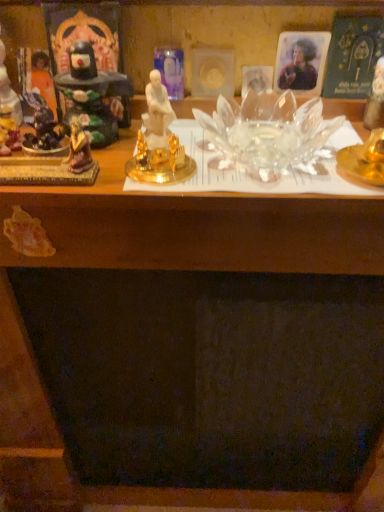
Measure the distance between point (19, 132) and camera.

The depth of point (19, 132) is 56.90 centimeters.

Find the location of a particular element. transparent glass candle at upper right, the fourth toy positioned from the left is located at coordinates (375, 99).

What are the coordinates of `orange fabric statue at left, the 2th person when ordered from right to left` in the screenshot? It's located at (43, 79).

Locate an element on the screen. transparent glass bowl at center is located at coordinates (196, 227).

Locate an element on the screen. This screenshot has width=384, height=512. matte black statue at left, which is the 1th toy in left-to-right order is located at coordinates (8, 91).

Between matte purple figurine at left, arranged as the 3th toy when viewed from the right, and matte plastic photo at upper right, which is the first person from right to left, which one has smaller size?

With smaller size is matte plastic photo at upper right, which is the first person from right to left.

Considering the points (15, 132) and (290, 85), which point is in front, point (15, 132) or point (290, 85)?

The point (15, 132) is in front.

Does matte purple figurine at left, arranged as the 3th toy when viewed from the right, turn towards matte plastic photo at upper right, positioned as the second person in left-to-right order?

No, matte purple figurine at left, arranged as the 3th toy when viewed from the right, is not turned towards matte plastic photo at upper right, positioned as the second person in left-to-right order.

Looking at this image, from the image's perspective, relative to orange fabric statue at left, the 2th person when ordered from right to left, is matte black statue at left, which is counted as the third toy, starting from the left, above or below?

Based on their image positions, matte black statue at left, which is counted as the third toy, starting from the left, is located beneath orange fabric statue at left, the 2th person when ordered from right to left.

Can you tell me how much matte black statue at left, the 2th toy when ordered from right to left, and orange fabric statue at left, the 2th person when ordered from right to left, differ in facing direction?

matte black statue at left, the 2th toy when ordered from right to left, and orange fabric statue at left, the 2th person when ordered from right to left, are facing 4.78 degrees away from each other.

From a real-world perspective, is matte black statue at left, the 2th toy when ordered from right to left, located higher than orange fabric statue at left, which ranks as the 1th person in left-to-right order?

Yes.

Is matte black statue at left, the 2th toy when ordered from right to left, wider than orange fabric statue at left, the 2th person when ordered from right to left?

Yes, matte black statue at left, the 2th toy when ordered from right to left, is wider than orange fabric statue at left, the 2th person when ordered from right to left.

Is transparent glass candle at upper right, the fourth toy positioned from the left, facing away from matte purple figurine at left, arranged as the 3th toy when viewed from the right?

transparent glass candle at upper right, the fourth toy positioned from the left, is not turned away from matte purple figurine at left, arranged as the 3th toy when viewed from the right.

Which is farther, (x=379, y=110) or (x=16, y=149)?

The point (x=379, y=110) is farther from the camera.

From the image's perspective, is transparent glass candle at upper right, the fourth toy positioned from the left, above or below matte purple figurine at left, the second toy positioned from the left?

Based on their image positions, transparent glass candle at upper right, the fourth toy positioned from the left, is located above matte purple figurine at left, the second toy positioned from the left.

Considering their positions, is transparent glass candle at upper right, acting as the 1th toy starting from the right, located in front of or behind matte purple figurine at left, the second toy positioned from the left?

transparent glass candle at upper right, acting as the 1th toy starting from the right, is behind matte purple figurine at left, the second toy positioned from the left.

Considering the relative positions of matte purple figurine at left, arranged as the 3th toy when viewed from the right, and orange fabric statue at left, which ranks as the 1th person in left-to-right order, in the image provided, is matte purple figurine at left, arranged as the 3th toy when viewed from the right, to the right of orange fabric statue at left, which ranks as the 1th person in left-to-right order, from the viewer's perspective?

In fact, matte purple figurine at left, arranged as the 3th toy when viewed from the right, is to the left of orange fabric statue at left, which ranks as the 1th person in left-to-right order.

In the image, is matte purple figurine at left, the second toy positioned from the left, positioned in front of or behind orange fabric statue at left, the 2th person when ordered from right to left?

matte purple figurine at left, the second toy positioned from the left, is positioned closer to the viewer than orange fabric statue at left, the 2th person when ordered from right to left.

Is matte purple figurine at left, arranged as the 3th toy when viewed from the right, not within orange fabric statue at left, the 2th person when ordered from right to left?

Yes, matte purple figurine at left, arranged as the 3th toy when viewed from the right, is located beyond the bounds of orange fabric statue at left, the 2th person when ordered from right to left.

Is matte black statue at left, which is the 1th toy in left-to-right order, bigger than transparent glass candle at upper right, acting as the 1th toy starting from the right?

Yes, matte black statue at left, which is the 1th toy in left-to-right order, is bigger than transparent glass candle at upper right, acting as the 1th toy starting from the right.

Between point (4, 105) and point (380, 104), which one is positioned in front?

The point (380, 104) is more forward.

Based on the photo, which object is closer to the camera taking this photo, matte black statue at left, which is the 4th toy from right to left, or transparent glass candle at upper right, the fourth toy positioned from the left?

Positioned in front is matte black statue at left, which is the 4th toy from right to left.

Is matte black statue at left, which is the 1th toy in left-to-right order, facing away from transparent glass candle at upper right, the fourth toy positioned from the left?

matte black statue at left, which is the 1th toy in left-to-right order, is not turned away from transparent glass candle at upper right, the fourth toy positioned from the left.

Considering the sizes of objects transparent glass candle at upper right, acting as the 1th toy starting from the right, and matte black statue at left, which is the 4th toy from right to left, in the image provided, who is bigger, transparent glass candle at upper right, acting as the 1th toy starting from the right, or matte black statue at left, which is the 4th toy from right to left,?

With larger size is matte black statue at left, which is the 4th toy from right to left.

From the image's perspective, count 2nd toys upward from the transparent glass candle at upper right, the fourth toy positioned from the left, and point to it. Please provide its 2D coordinates.

[(8, 91)]

Is transparent glass candle at upper right, the fourth toy positioned from the left, at the left side of matte black statue at left, which is the 1th toy in left-to-right order?

No, transparent glass candle at upper right, the fourth toy positioned from the left, is not to the left of matte black statue at left, which is the 1th toy in left-to-right order.

Is transparent glass candle at upper right, the fourth toy positioned from the left, facing towards matte black statue at left, which is the 1th toy in left-to-right order?

No.

Is matte purple figurine at left, arranged as the 3th toy when viewed from the right, aimed at matte black statue at left, the 2th toy when ordered from right to left?

No, matte purple figurine at left, arranged as the 3th toy when viewed from the right, does not turn towards matte black statue at left, the 2th toy when ordered from right to left.

From a real-world perspective, is matte purple figurine at left, the second toy positioned from the left, on top of matte black statue at left, which is counted as the third toy, starting from the left?

No.

Is there a large distance between matte purple figurine at left, arranged as the 3th toy when viewed from the right, and matte black statue at left, the 2th toy when ordered from right to left?

No, there isn't a large distance between matte purple figurine at left, arranged as the 3th toy when viewed from the right, and matte black statue at left, the 2th toy when ordered from right to left.

You are a GUI agent. You are given a task and a screenshot of the screen. Output one action in this format:
    pyautogui.click(x=<x>, y=<y>)
    Task: Click on the 3rd toy below the matte plastic photo at upper right, which is the first person from right to left (from a real-world perspective)
    Image resolution: width=384 pixels, height=512 pixels.
    Given the screenshot: What is the action you would take?
    pyautogui.click(x=9, y=136)

From the image's perspective, starting from the orange fabric statue at left, which ranks as the 1th person in left-to-right order, which toy is the 1st one below? Please provide its 2D coordinates.

[(92, 94)]

Looking at the image, which one is located further to orange fabric statue at left, which ranks as the 1th person in left-to-right order, matte black statue at left, which is the 4th toy from right to left, or transparent glass bowl at center?

transparent glass bowl at center lies further to orange fabric statue at left, which ranks as the 1th person in left-to-right order, than the other object.

From the picture: Estimate the real-world distances between objects in this image. Which object is closer to matte purple figurine at left, arranged as the 3th toy when viewed from the right, matte black statue at left, the 2th toy when ordered from right to left, or matte black statue at left, which is the 4th toy from right to left?

matte black statue at left, which is the 4th toy from right to left, is closer to matte purple figurine at left, arranged as the 3th toy when viewed from the right.

Considering their positions, is matte black statue at left, the 2th toy when ordered from right to left, positioned further to matte purple figurine at left, the second toy positioned from the left, than matte plastic photo at upper right, positioned as the second person in left-to-right order?

matte plastic photo at upper right, positioned as the second person in left-to-right order, lies further to matte purple figurine at left, the second toy positioned from the left, than the other object.

Looking at the image, which one is located closer to matte black statue at left, which is the 1th toy in left-to-right order, transparent glass bowl at center or matte plastic photo at upper right, positioned as the second person in left-to-right order?

The object closer to matte black statue at left, which is the 1th toy in left-to-right order, is transparent glass bowl at center.

Based on their spatial positions, is transparent glass bowl at center or matte black statue at left, which is counted as the third toy, starting from the left, further from matte plastic photo at upper right, positioned as the second person in left-to-right order?

transparent glass bowl at center is further to matte plastic photo at upper right, positioned as the second person in left-to-right order.

Estimate the real-world distances between objects in this image. Which object is further from transparent glass candle at upper right, the fourth toy positioned from the left, matte purple figurine at left, arranged as the 3th toy when viewed from the right, or matte black statue at left, which is counted as the third toy, starting from the left?

matte purple figurine at left, arranged as the 3th toy when viewed from the right, is positioned further to the anchor transparent glass candle at upper right, the fourth toy positioned from the left.

When comparing their distances from matte black statue at left, which is counted as the third toy, starting from the left, does orange fabric statue at left, the 2th person when ordered from right to left, or matte black statue at left, which is the 1th toy in left-to-right order, seem further?

matte black statue at left, which is the 1th toy in left-to-right order, is further to matte black statue at left, which is counted as the third toy, starting from the left.

When comparing their distances from matte black statue at left, which is the 1th toy in left-to-right order, does transparent glass candle at upper right, acting as the 1th toy starting from the right, or matte black statue at left, the 2th toy when ordered from right to left, seem closer?

The object closer to matte black statue at left, which is the 1th toy in left-to-right order, is matte black statue at left, the 2th toy when ordered from right to left.

Locate an element on the screen. Image resolution: width=384 pixels, height=512 pixels. toy situated between matte purple figurine at left, the second toy positioned from the left, and transparent glass candle at upper right, acting as the 1th toy starting from the right, from left to right is located at coordinates (92, 94).

Find the location of a particular element. Image resolution: width=384 pixels, height=512 pixels. person between matte purple figurine at left, arranged as the 3th toy when viewed from the right, and matte black statue at left, which is counted as the third toy, starting from the left, from left to right is located at coordinates (43, 79).

Locate an element on the screen. The image size is (384, 512). toy between orange fabric statue at left, the 2th person when ordered from right to left, and matte plastic photo at upper right, which is the first person from right to left, in the horizontal direction is located at coordinates [92, 94].

Find the location of `table between orange fabric statue at left, the 2th person when ordered from right to left, and matte plastic photo at upper right, which is the first person from right to left`. table between orange fabric statue at left, the 2th person when ordered from right to left, and matte plastic photo at upper right, which is the first person from right to left is located at coordinates (196, 227).